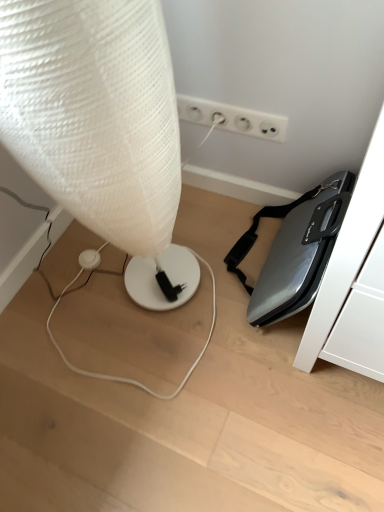
Locate an element on the screen. This screenshot has height=512, width=384. free space below white textured lamp at left (from a real-world perspective) is located at coordinates (135, 306).